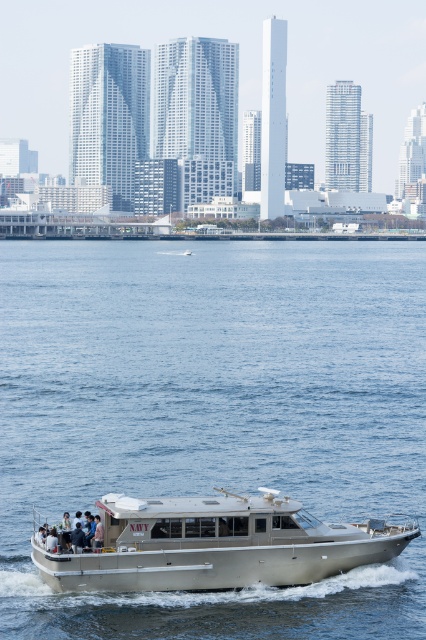
Question: From the image, what is the correct spatial relationship of blue water at center in relation to metallic silver boat at center?

Choices:
 (A) above
 (B) below

Answer: (A)

Question: Does blue water at center have a smaller size compared to metallic silver boat at center?

Choices:
 (A) yes
 (B) no

Answer: (B)

Question: Which of the following is the farthest from the observer?

Choices:
 (A) blue water at center
 (B) metallic silver boat at center

Answer: (B)

Question: Can you confirm if blue water at center is positioned to the left of metallic silver boat at center?

Choices:
 (A) no
 (B) yes

Answer: (B)